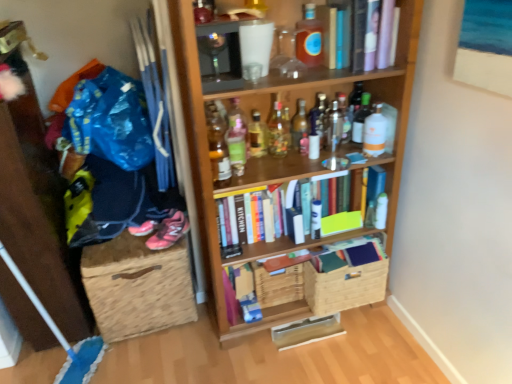
Question: Could you tell me if translucent glass bottle at upper center, which is the eleventh bottle from left to right, is facing blue fabric pants at left?

Choices:
 (A) yes
 (B) no

Answer: (B)

Question: From the image's perspective, is translucent glass bottle at upper center, which is the eleventh bottle from left to right, over blue fabric pants at left?

Choices:
 (A) yes
 (B) no

Answer: (A)

Question: Is translucent glass bottle at upper center, which is the eleventh bottle from left to right, at the left side of blue fabric pants at left?

Choices:
 (A) no
 (B) yes

Answer: (A)

Question: Considering the relative sizes of translucent glass bottle at upper center, the 1th bottle when ordered from right to left, and blue fabric pants at left in the image provided, is translucent glass bottle at upper center, the 1th bottle when ordered from right to left, wider than blue fabric pants at left?

Choices:
 (A) no
 (B) yes

Answer: (A)

Question: Is translucent glass bottle at upper center, which is the eleventh bottle from left to right, oriented away from blue fabric pants at left?

Choices:
 (A) yes
 (B) no

Answer: (B)

Question: Is clear glass bottle at upper center, placed as the 3th bottle when sorted from right to left, taller or shorter than wooden bookcase at center?

Choices:
 (A) short
 (B) tall

Answer: (A)

Question: Considering the positions of clear glass bottle at upper center, which appears as the ninth bottle when viewed from the left, and wooden bookcase at center in the image, is clear glass bottle at upper center, which appears as the ninth bottle when viewed from the left, bigger or smaller than wooden bookcase at center?

Choices:
 (A) big
 (B) small

Answer: (B)

Question: Does point (344, 104) appear closer or farther from the camera than point (186, 92)?

Choices:
 (A) farther
 (B) closer

Answer: (A)

Question: Which is correct: clear glass bottle at upper center, which appears as the ninth bottle when viewed from the left, is inside wooden bookcase at center, or outside of it?

Choices:
 (A) outside
 (B) inside

Answer: (B)

Question: From a real-world perspective, relative to translucent glass bottle at center, which appears as the 3th bottle when viewed from the left, is wooden crate at center, which is the second basket in right-to-left order, vertically above or below?

Choices:
 (A) below
 (B) above

Answer: (A)

Question: Is wooden crate at center, which is the second basket in right-to-left order, spatially inside translucent glass bottle at center, which appears as the 3th bottle when viewed from the left, or outside of it?

Choices:
 (A) inside
 (B) outside

Answer: (B)

Question: Considering the positions of wooden crate at center, positioned as the 1th basket in left-to-right order, and translucent glass bottle at center, which appears as the 3th bottle when viewed from the left, in the image, is wooden crate at center, positioned as the 1th basket in left-to-right order, bigger or smaller than translucent glass bottle at center, which appears as the 3th bottle when viewed from the left,?

Choices:
 (A) small
 (B) big

Answer: (B)

Question: Considering the positions of wooden crate at center, which is the second basket in right-to-left order, and translucent glass bottle at center, which appears as the 3th bottle when viewed from the left, in the image, is wooden crate at center, which is the second basket in right-to-left order, wider or thinner than translucent glass bottle at center, which appears as the 3th bottle when viewed from the left,?

Choices:
 (A) wide
 (B) thin

Answer: (A)

Question: Looking at the image, does burlap storage box at lower left seem bigger or smaller compared to woven brown basket at lower center, the first basket when ordered from right to left?

Choices:
 (A) small
 (B) big

Answer: (B)

Question: From a real-world perspective, is burlap storage box at lower left above or below woven brown basket at lower center, the first basket when ordered from right to left?

Choices:
 (A) below
 (B) above

Answer: (A)